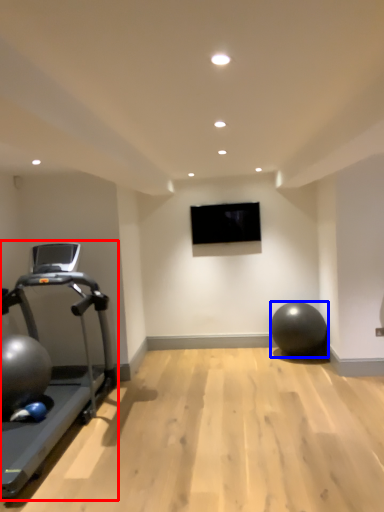
Question: Which point is closer to the camera, treadmill (highlighted by a red box) or ball (highlighted by a blue box)?

Choices:
 (A) treadmill
 (B) ball

Answer: (A)